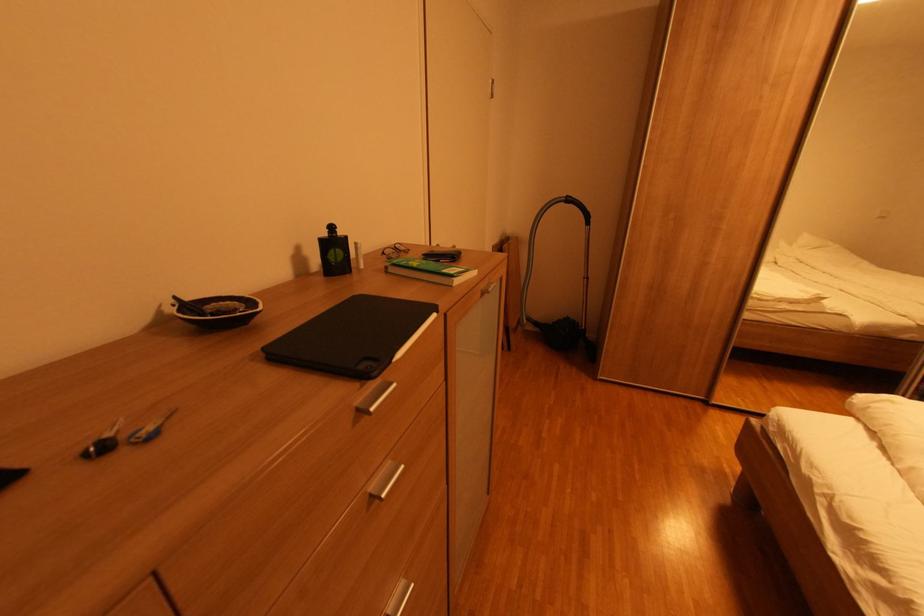
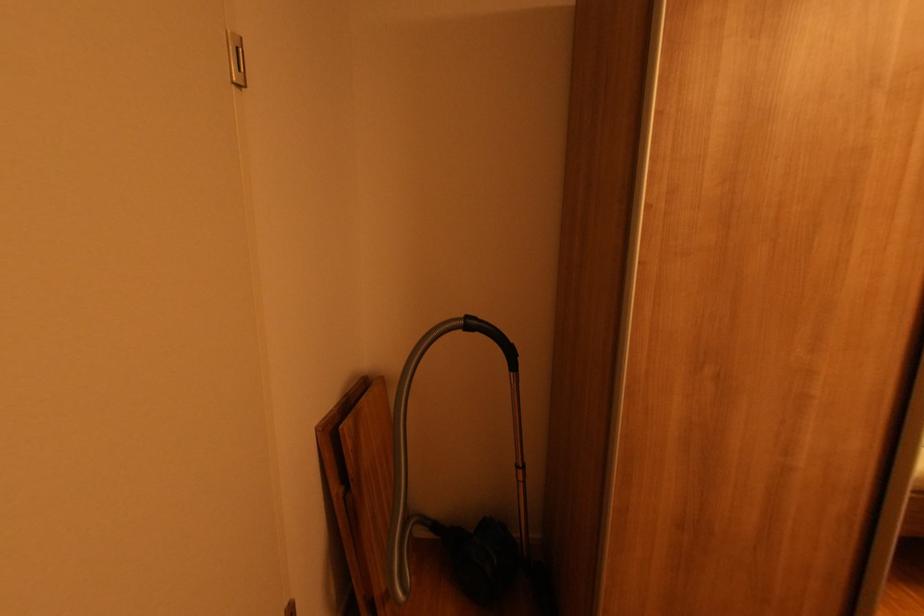
Question: The images are taken continuously from a first-person perspective. In which direction are you moving?

Choices:
 (A) Left
 (B) Right
 (C) Forward
 (D) Backward

Answer: (C)